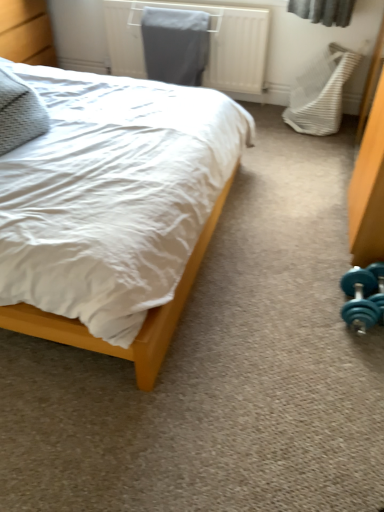
Question: Considering the positions of point (28, 330) and point (297, 105), is point (28, 330) closer or farther from the camera than point (297, 105)?

Choices:
 (A) closer
 (B) farther

Answer: (A)

Question: From the image's perspective, is wooden bed at left above or below white textured swivel chair at right?

Choices:
 (A) below
 (B) above

Answer: (A)

Question: Which object is positioned closest to the wooden bed at left?

Choices:
 (A) textured gray pillow at left
 (B) white textured swivel chair at right
 (C) teal rubber dumbbell at lower right
 (D) metallic gray radiator at upper center

Answer: (A)

Question: Based on their relative distances, which object is farther from the white textured swivel chair at right?

Choices:
 (A) metallic gray radiator at upper center
 (B) wooden bed at left
 (C) teal rubber dumbbell at lower right
 (D) textured gray pillow at left

Answer: (D)